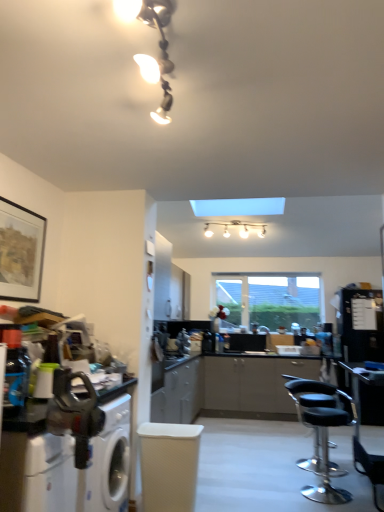
This screenshot has height=512, width=384. Identify the location of vacant area on top of metallic glass light fixture at upper center (from a real-world perspective). (153, 40).